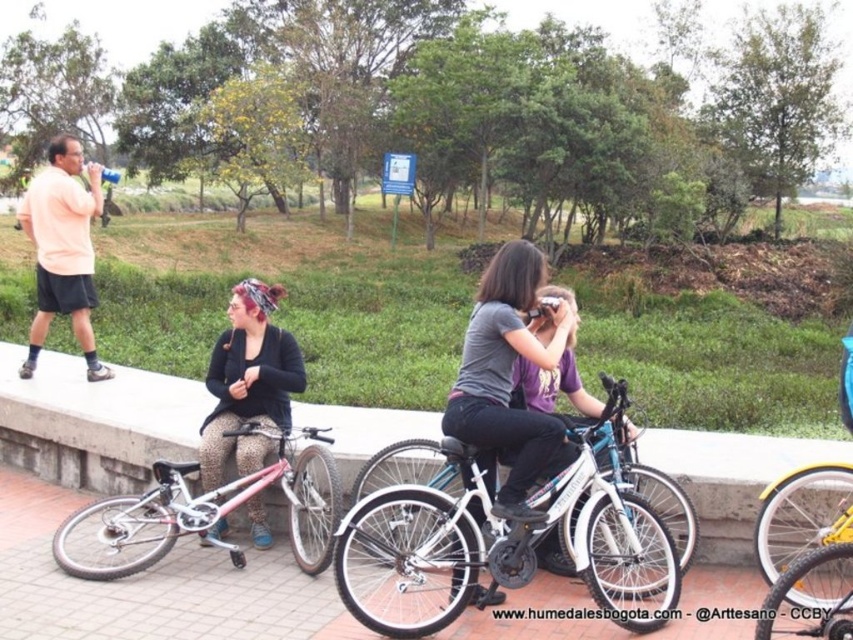
You are planning to ride a bike and need to choose between the pink metallic bicycle at lower left and the leopard print pants at center. Which one has a greater width?

The pink metallic bicycle at lower left has a greater width than the leopard print pants at center.

You are a photographer setting up a tripod in the park. You need to position your camera so that both the pink metallic bicycle at lower left and the leopard print pants at center are in frame. Given their sizes, which object should you ensure is closer to the camera to maintain both in focus?

The pink metallic bicycle at lower left is larger in size than the leopard print pants at center. To keep both in focus, position the leopard print pants at center closer to the camera since smaller objects need to be nearer to maintain focus compared to larger ones.

You are planning to park your bike in a narrow alley that is only wide enough for a standard bicycle. You see the white matte bicycle at center and the yellow matte bicycle at lower right. Which bicycle should you choose to ensure it fits in the alley?

The yellow matte bicycle at lower right should be chosen because its width is narrower than the white matte bicycle at center, making it more likely to fit in the narrow alley.